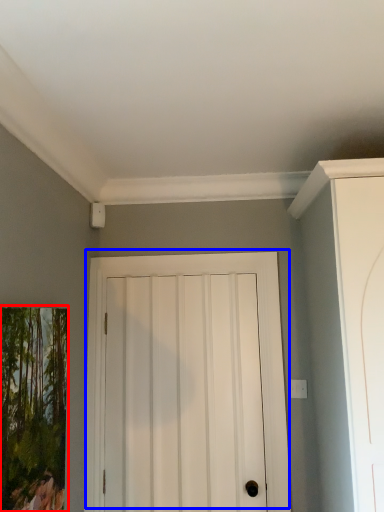
Question: Among these objects, which one is nearest to the camera, picture frame (highlighted by a red box) or door (highlighted by a blue box)?

Choices:
 (A) picture frame
 (B) door

Answer: (A)